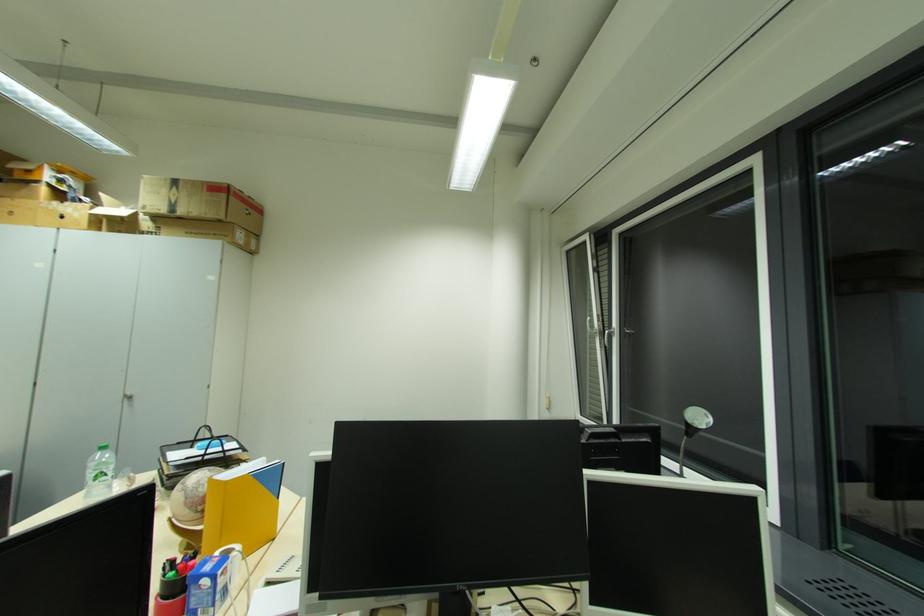
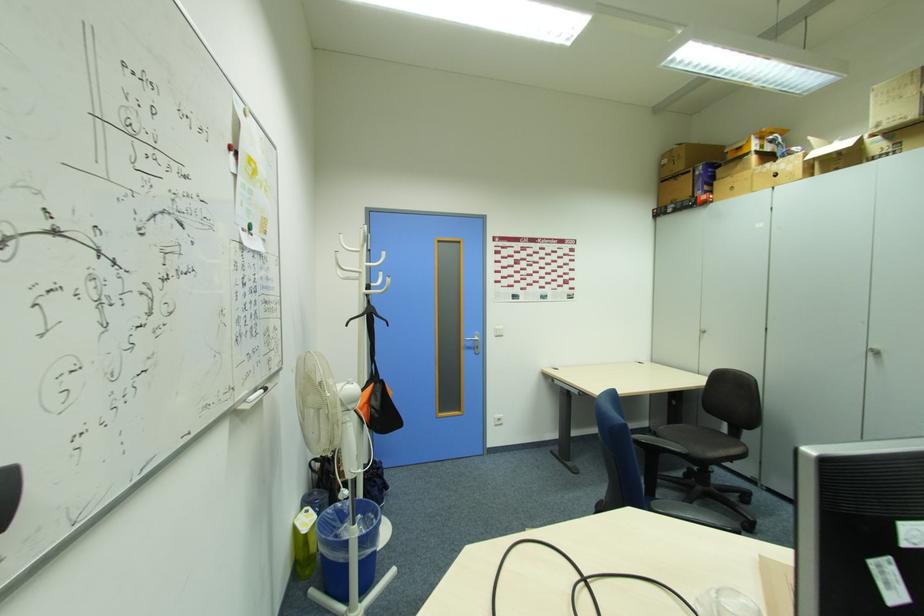
Where in the second image is the point corresponding to (152,209) from the first image?

(889, 123)